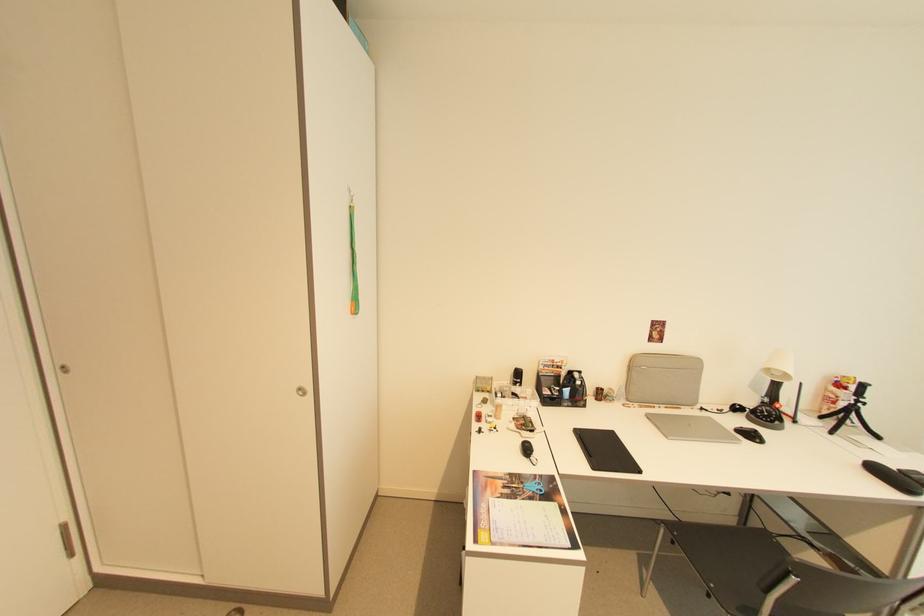
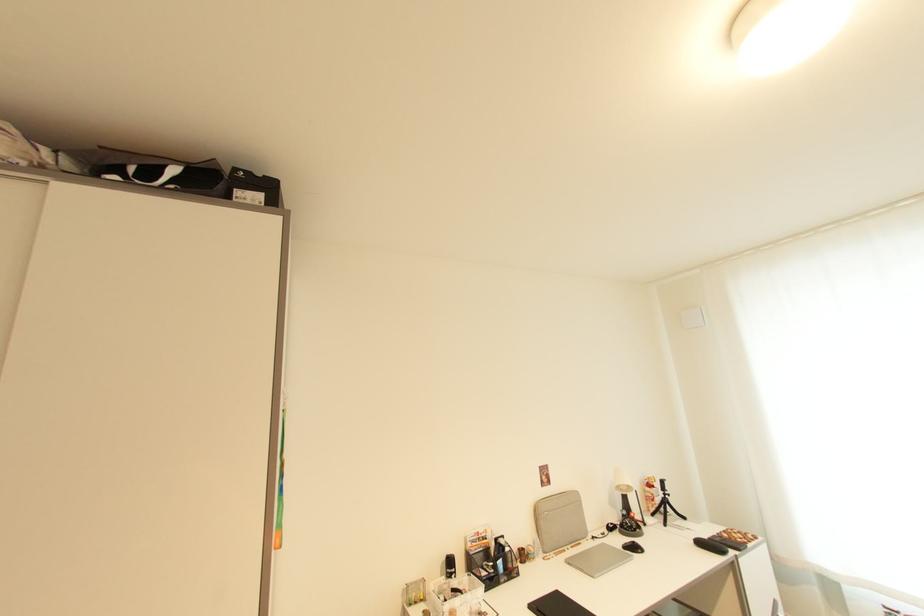
Based on the continuous images, in which direction is the camera rotating?

The camera rotated toward right-up.